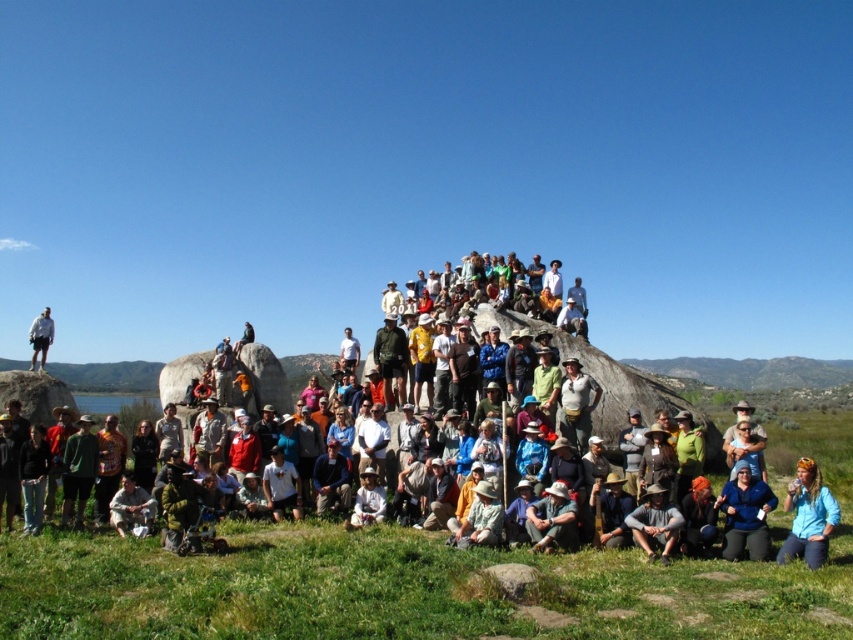
You are a photographer trying to capture a photo of the matte khaki pants at center and the matte khaki shorts at lower left. Which object is located lower in the image?

The matte khaki shorts at lower left is located lower in the image than the matte khaki pants at center.

You are standing on the grassy hillside and want to take a photo of two specific points in the scene. The first point is at coordinate point (718, 387) and the second is at point (763, 525). Which point will appear closer to you in the photo?

Point (718, 387) is further to the camera than point (763, 525), so the second point will appear closer to you in the photo.